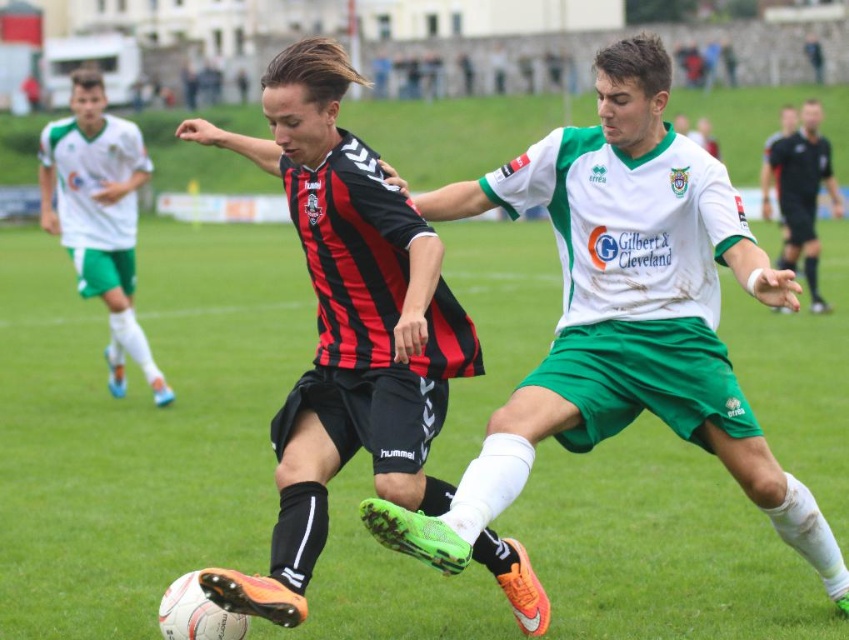
Question: Does matte black shorts at center appear under white/green jersey at center?

Choices:
 (A) no
 (B) yes

Answer: (A)

Question: Can you confirm if matte black shorts at center is positioned to the left of white/green jersey at center?

Choices:
 (A) yes
 (B) no

Answer: (A)

Question: Is the position of matte black shorts at center more distant than that of white/green jersey at center?

Choices:
 (A) yes
 (B) no

Answer: (B)

Question: Which point is farther from the camera taking this photo?

Choices:
 (A) (117, 220)
 (B) (825, 188)

Answer: (B)

Question: Which object appears closest to the camera in this image?

Choices:
 (A) matte black shorts at center
 (B) white/green jersey at center

Answer: (A)